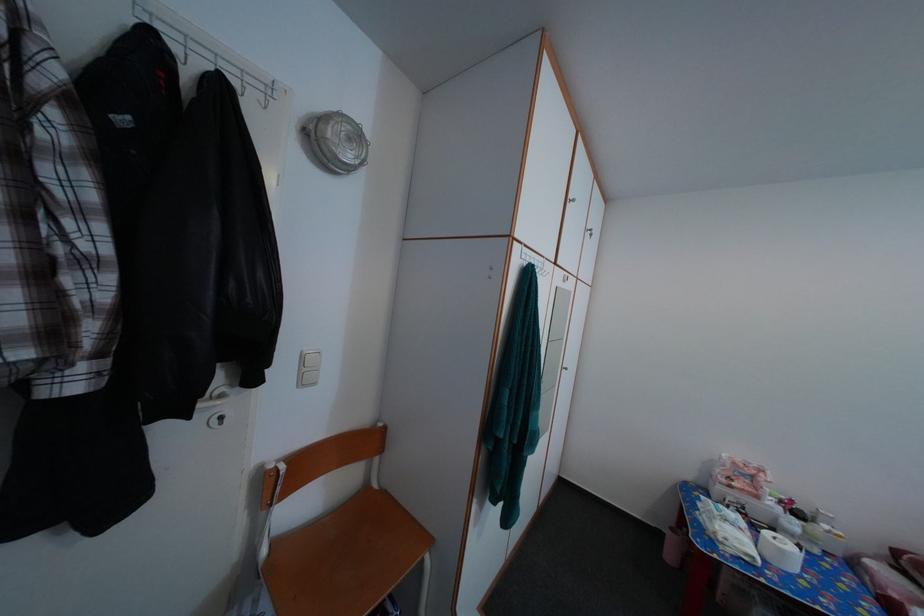
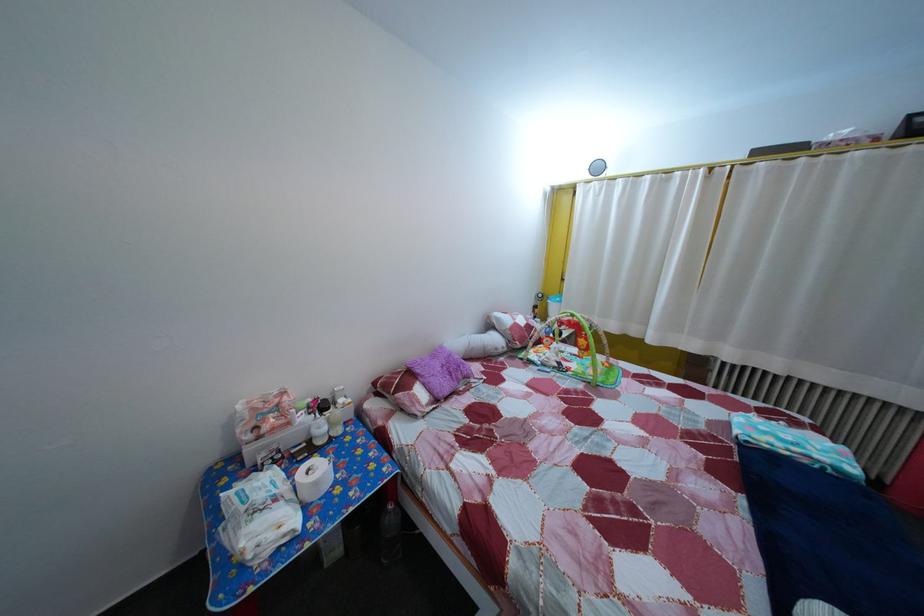
Locate, in the second image, the point that corresponds to (782,511) in the first image.

(311, 427)